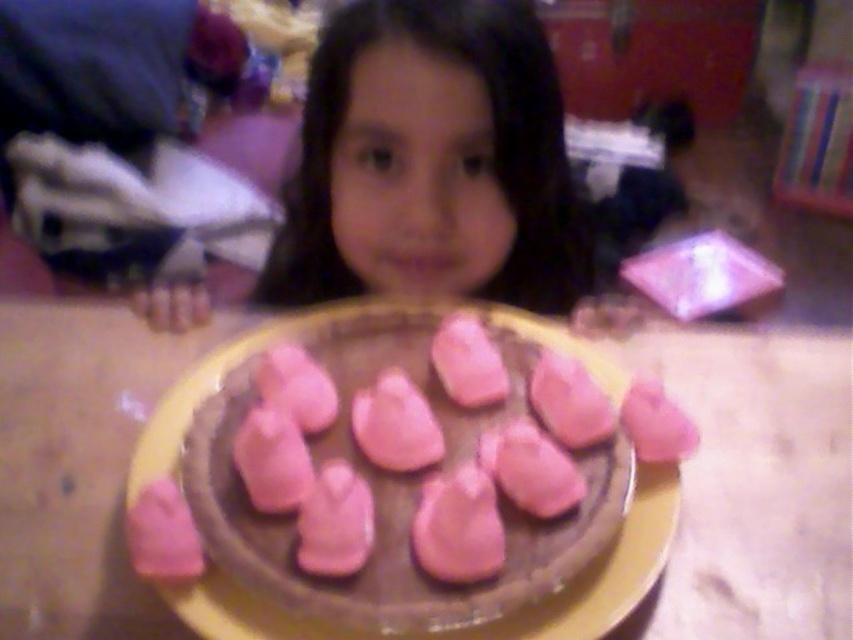
Consider the image. Is smooth skin face at center behind pink matte meringue at center?

Yes.

Based on the photo, can you confirm if smooth skin face at center is bigger than pink matte meringue at center?

Correct, smooth skin face at center is larger in size than pink matte meringue at center.

Does point (314, 300) come behind point (691, 451)?

That is True.

Locate an element on the screen. This screenshot has width=853, height=640. smooth skin face at center is located at coordinates (432, 161).

Describe the element at coordinates (432, 161) in the screenshot. I see `smooth skin face at center` at that location.

Measure the distance between point (x=550, y=188) and camera.

Point (x=550, y=188) is 30.43 inches away from camera.

Measure the distance between point (351, 100) and camera.

Point (351, 100) and camera are 27.15 inches apart.

Find the location of a particular element. smooth skin face at center is located at coordinates (432, 161).

Who is positioned more to the right, pink matte chocolate cake at center or pink matte meringue at center?

pink matte meringue at center is more to the right.

How far apart are pink matte chocolate cake at center and pink matte meringue at center?

pink matte chocolate cake at center is 18.96 centimeters away from pink matte meringue at center.

This screenshot has height=640, width=853. In order to click on pink matte chocolate cake at center in this screenshot , I will do `click(392, 480)`.